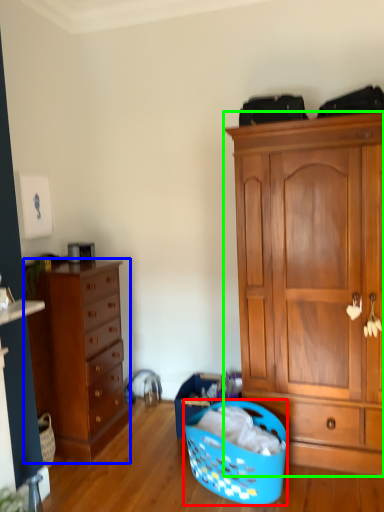
Question: Which object is positioned farthest from picnic basket (highlighted by a red box)? Select from chest of drawers (highlighted by a blue box) and cabinetry (highlighted by a green box).

Choices:
 (A) chest of drawers
 (B) cabinetry

Answer: (A)